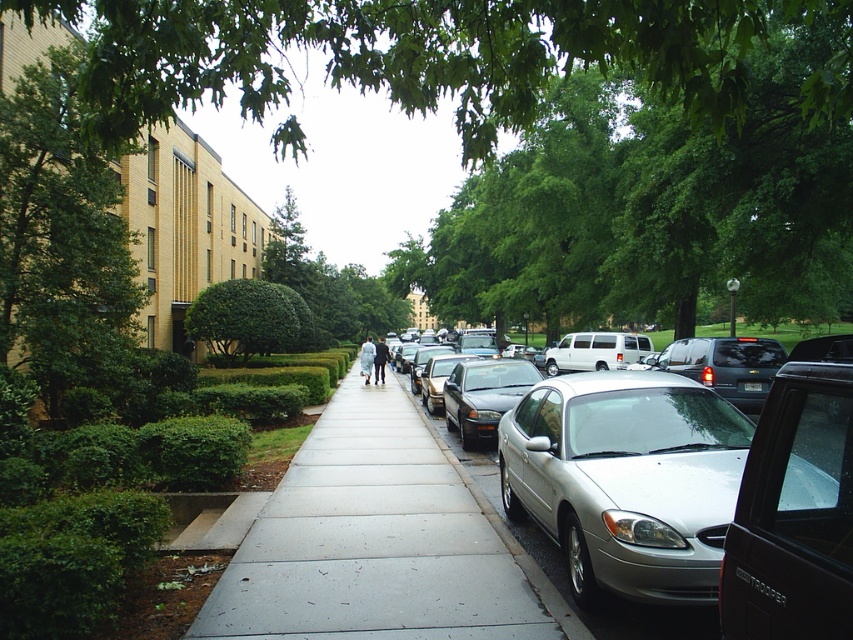
You are a delivery person trying to park your van between the silver metallic sedan at center and the shiny silver sedan at center right. Can you fit your van, which is 2 meters tall, between them?

The silver metallic sedan at center is taller than the shiny silver sedan at center right. Since the tallest object between them is the silver metallic sedan at center, and the description does not provide specific height measurements, it is impossible to determine if the van can fit based on the given information.

Based on the photo, you are standing on the sidewalk in the urban street scene and want to cross the street to reach the building on the left. Is the silver metallic sedan at center blocking your path?

The silver metallic sedan at center is located at point (799, 481), which is near the curb on the right side of the sidewalk. Since the building is on the left side of the frame, the sedan is parked on the opposite side of the sidewalk from the building. Therefore, it does not block your path to the building.

You are a pedestrian standing on the sidewalk. You see the green leafy tree at upper center and the shiny silver sedan at center right. Which object is closer to you?

The shiny silver sedan at center right is closer to you because it is only 13.60 meters away from the green leafy tree at upper center, but since you are on the sidewalk, the sedan is likely positioned closer to the street while the tree is further back towards the building.